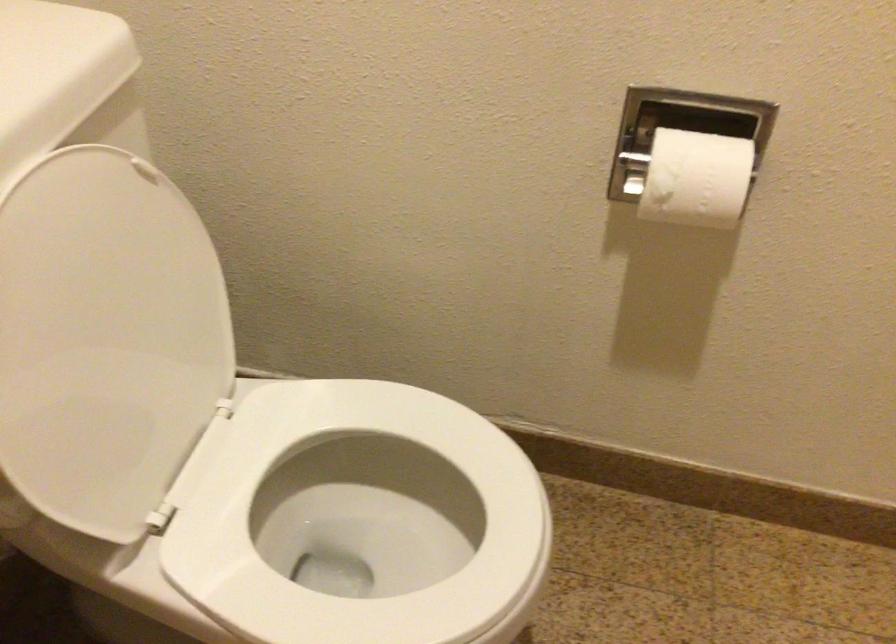
Find where to lower the white toilet lid. Please return your answer as a coordinate pair (x, y).

(105, 339)